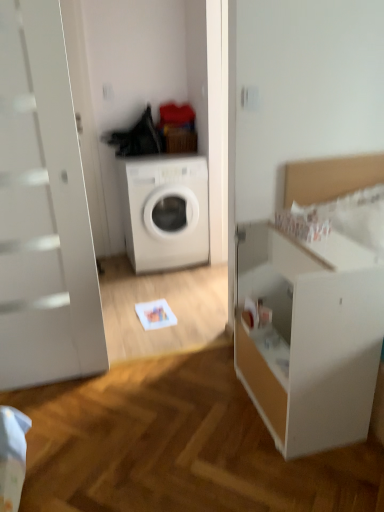
Locate an element on the screen. The height and width of the screenshot is (512, 384). free space above white matte dresser at right (from a real-world perspective) is located at coordinates (322, 247).